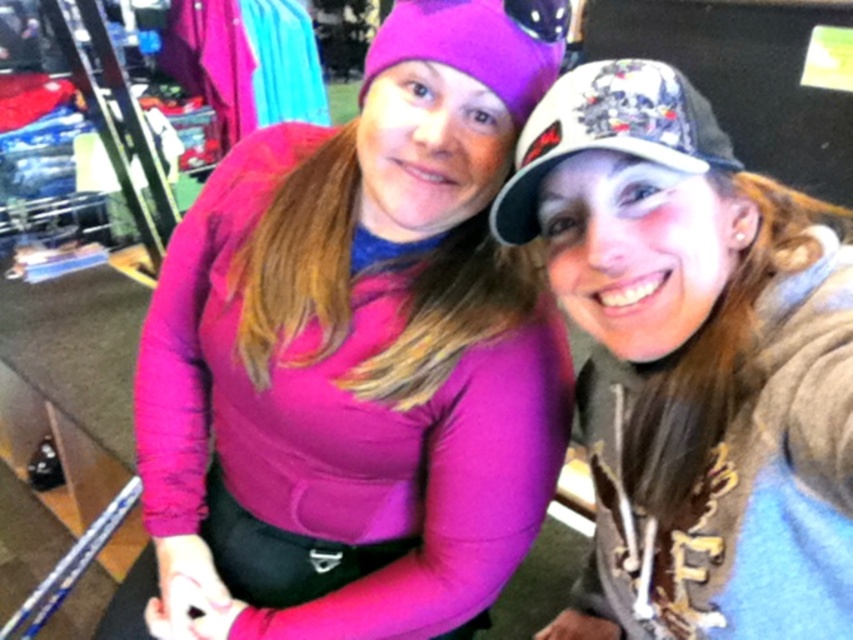
Question: Which object is farther from the camera taking this photo?

Choices:
 (A) white textured cap at upper right
 (B) matte pink sweater at center

Answer: (B)

Question: Is matte pink sweater at center bigger than white textured cap at upper right?

Choices:
 (A) yes
 (B) no

Answer: (A)

Question: Does matte pink sweater at center appear on the left side of white textured cap at upper right?

Choices:
 (A) no
 (B) yes

Answer: (B)

Question: Which object is closer to the camera taking this photo?

Choices:
 (A) white textured cap at upper right
 (B) matte pink sweater at center

Answer: (A)

Question: Is matte pink sweater at center in front of white textured cap at upper right?

Choices:
 (A) no
 (B) yes

Answer: (A)

Question: Which point is closer to the camera?

Choices:
 (A) matte pink sweater at center
 (B) white textured cap at upper right

Answer: (B)